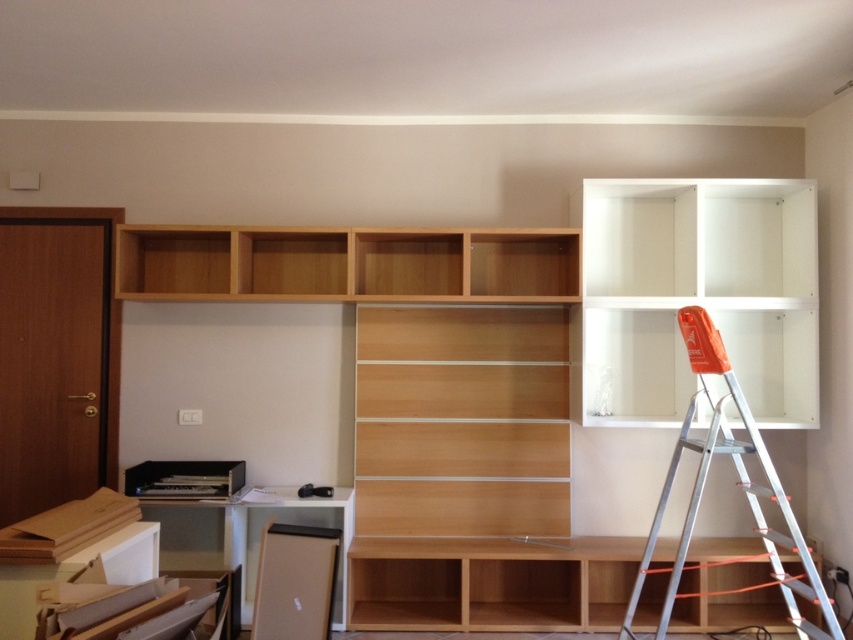
From the picture: Who is shorter, white matte cabinet at upper right or silver metallic ladder at upper right?

white matte cabinet at upper right is shorter.

Which is behind, point (775, 308) or point (788, 515)?

The point (775, 308) is more distant.

Where is `white matte cabinet at upper right`? white matte cabinet at upper right is located at coordinates (698, 296).

Is point (721, 221) farther from camera compared to point (668, 563)?

Yes, it is behind point (668, 563).

Between light wood bookshelf at center and light wood shelf at center, which one is positioned higher?

light wood bookshelf at center is higher up.

Which is in front, point (570, 388) or point (613, 593)?

Positioned in front is point (570, 388).

Identify the location of light wood bookshelf at center. (523, 362).

Who is lower down, white matte cabinet at upper right or light wood shelf at center?

light wood shelf at center

Does white matte cabinet at upper right have a lesser height compared to light wood shelf at center?

Incorrect, white matte cabinet at upper right's height does not fall short of light wood shelf at center's.

Between point (645, 241) and point (730, 564), which one is positioned behind?

Point (730, 564)

The image size is (853, 640). What are the coordinates of `white matte cabinet at upper right` in the screenshot? It's located at (698, 296).